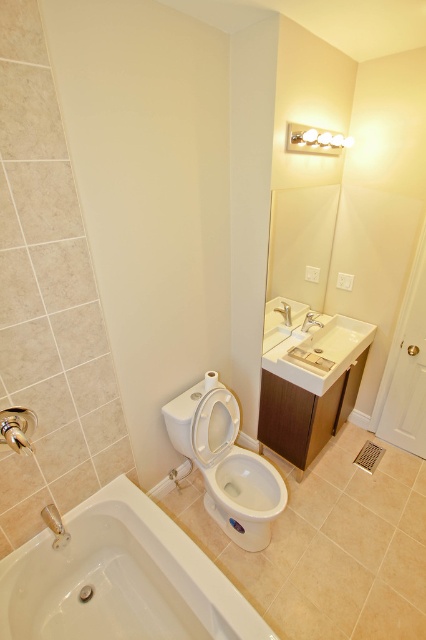
You are a plumber inspecting a bathroom. You need to determine which object is taller between the white glossy toilet bowl at center and the satin nickel faucet at sink right. Based on the scene description, which one is taller?

The white glossy toilet bowl at center is taller than the satin nickel faucet at sink right.

You are a plumber inspecting the bathroom layout. You need to locate the main water valve for the satin nickel faucet at sink right. According to the scene description, where would the valve most likely be positioned relative to the white ceramic sink at center?

The white ceramic sink at center is positioned under the satin nickel faucet at sink right, so the main water valve for the satin nickel faucet at sink right would likely be located above the white ceramic sink at center.